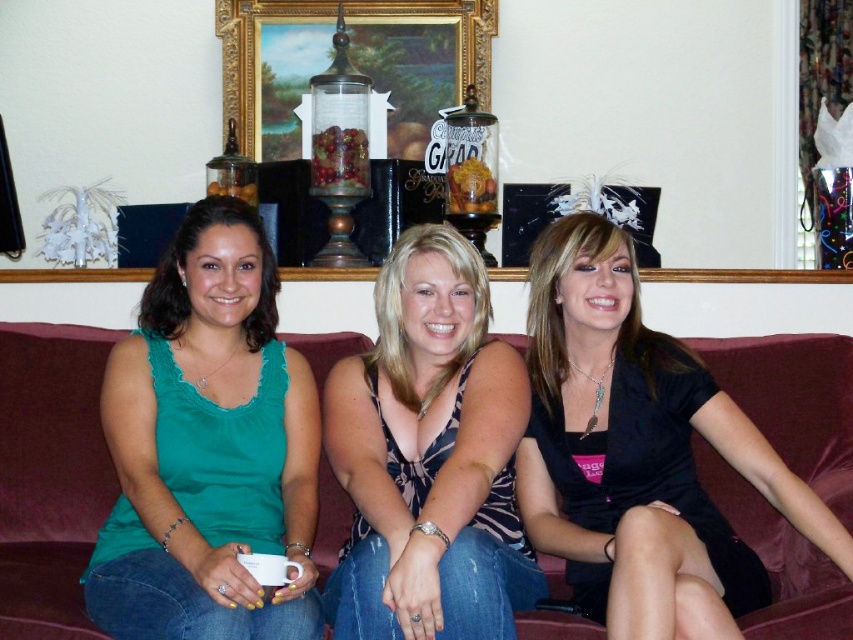
Question: Which of these objects is positioned closest to the green fabric tank top at center?

Choices:
 (A) black satin dress at center
 (B) maroon fabric couch at center
 (C) printed fabric tank top at center

Answer: (C)

Question: Does maroon fabric couch at center have a smaller size compared to printed fabric tank top at center?

Choices:
 (A) yes
 (B) no

Answer: (A)

Question: Which point appears farthest from the camera in this image?

Choices:
 (A) (143, 589)
 (B) (585, 324)
 (C) (421, 22)

Answer: (C)

Question: Can you confirm if maroon fabric couch at center is thinner than printed fabric tank top at center?

Choices:
 (A) yes
 (B) no

Answer: (A)

Question: Among these objects, which one is nearest to the camera?

Choices:
 (A) goldmetallicpicture frame at upper center
 (B) green fabric tank top at center
 (C) printed fabric tank top at center

Answer: (B)

Question: Can you confirm if printed fabric tank top at center is positioned to the right of goldmetallicpicture frame at upper center?

Choices:
 (A) no
 (B) yes

Answer: (B)